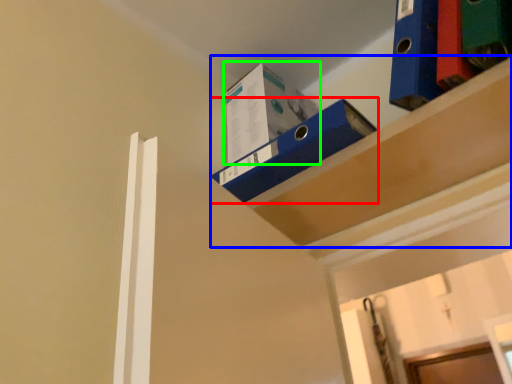
Question: Based on their relative distances, which object is farther from shelf (highlighted by a red box)? Choose from shelf (highlighted by a blue box) and box (highlighted by a green box).

Choices:
 (A) shelf
 (B) box

Answer: (B)